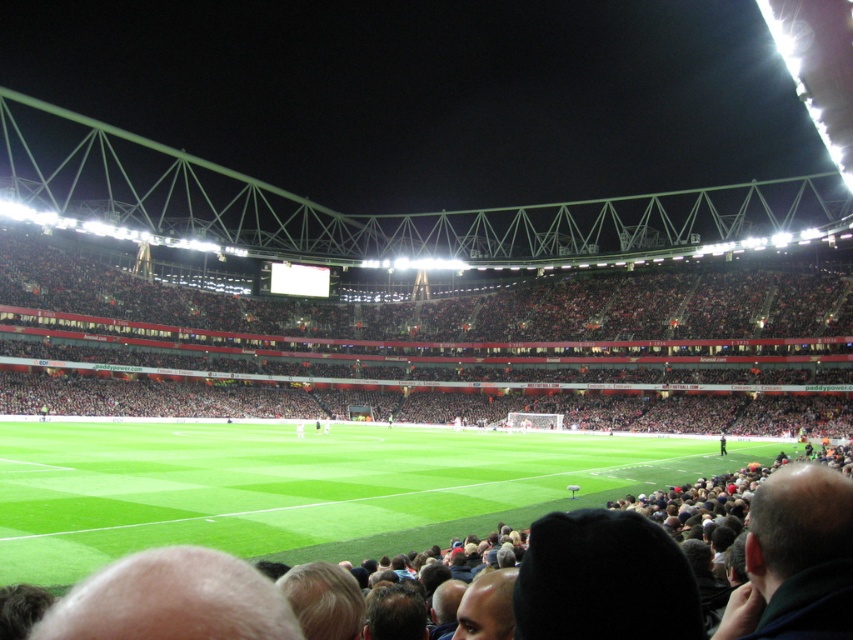
Question: Can you confirm if green grass at center is positioned below dark red seats at center?

Choices:
 (A) no
 (B) yes

Answer: (B)

Question: Which object appears farthest from the camera in this image?

Choices:
 (A) green grass at center
 (B) dark red seats at center

Answer: (B)

Question: Can you confirm if green grass at center is thinner than dark red seats at center?

Choices:
 (A) no
 (B) yes

Answer: (B)

Question: Which point is farther to the camera?

Choices:
 (A) (802, 420)
 (B) (367, 484)

Answer: (A)

Question: Can you confirm if green grass at center is positioned below dark red seats at center?

Choices:
 (A) yes
 (B) no

Answer: (A)

Question: Which object appears closest to the camera in this image?

Choices:
 (A) green grass at center
 (B) dark red seats at center

Answer: (A)